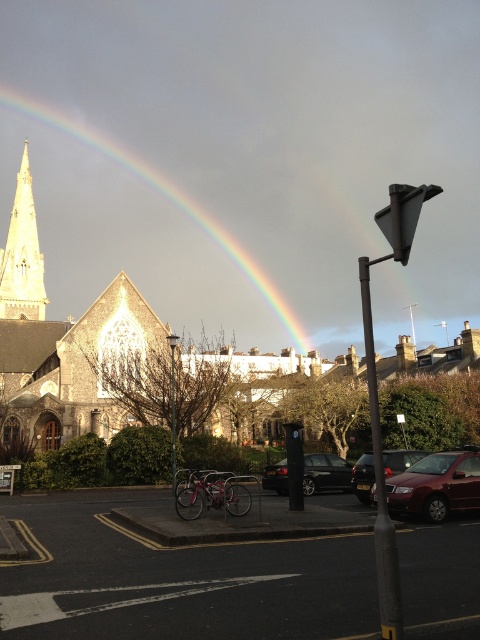
Is point (231, 244) less distant than point (345, 483)?

No, (231, 244) is behind (345, 483).

Who is more forward, (240, 262) or (309, 477)?

Point (309, 477) is in front.

Identify the location of rainbow translucent at upper center. (166, 204).

Can you confirm if shiny maroon sedan at lower right is taller than black glossy car at center?

A: No, shiny maroon sedan at lower right is not taller than black glossy car at center.

Does shiny maroon sedan at lower right appear over black glossy car at center?

Yes, shiny maroon sedan at lower right is above black glossy car at center.

Locate an element on the screen. shiny maroon sedan at lower right is located at coordinates (436, 484).

Between rainbow translucent at upper center and shiny metallic car at lower right, which one has less height?

shiny metallic car at lower right is shorter.

Does rainbow translucent at upper center have a larger size compared to shiny metallic car at lower right?

Yes.

The image size is (480, 640). Describe the element at coordinates (166, 204) in the screenshot. I see `rainbow translucent at upper center` at that location.

You are a GUI agent. You are given a task and a screenshot of the screen. Output one action in this format:
    pyautogui.click(x=<x>, y=<y>)
    Task: Click on the rainbow translucent at upper center
    
    Given the screenshot: What is the action you would take?
    pyautogui.click(x=166, y=204)